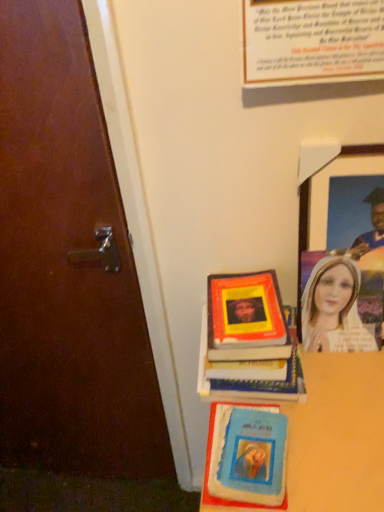
Question: From a real-world perspective, is blue matte book at lower center below smooth wooden table at lower right?

Choices:
 (A) no
 (B) yes

Answer: (A)

Question: From the image's perspective, is blue matte book at lower center on top of smooth wooden table at lower right?

Choices:
 (A) yes
 (B) no

Answer: (A)

Question: Is blue matte book at lower center closer to camera compared to smooth wooden table at lower right?

Choices:
 (A) yes
 (B) no

Answer: (B)

Question: Is blue matte book at lower center in contact with smooth wooden table at lower right?

Choices:
 (A) no
 (B) yes

Answer: (A)

Question: Does blue matte book at lower center have a lesser height compared to smooth wooden table at lower right?

Choices:
 (A) no
 (B) yes

Answer: (B)

Question: From the image's perspective, is blue matte book at lower center below smooth wooden table at lower right?

Choices:
 (A) no
 (B) yes

Answer: (A)

Question: From a real-world perspective, is wooden picture frame at upper right located higher than hardcover book at center?

Choices:
 (A) yes
 (B) no

Answer: (A)

Question: Is wooden picture frame at upper right facing away from hardcover book at center?

Choices:
 (A) yes
 (B) no

Answer: (B)

Question: Is wooden picture frame at upper right aimed at hardcover book at center?

Choices:
 (A) no
 (B) yes

Answer: (A)

Question: Can we say wooden picture frame at upper right lies outside hardcover book at center?

Choices:
 (A) yes
 (B) no

Answer: (A)

Question: Considering the relative sizes of wooden picture frame at upper right and hardcover book at center in the image provided, is wooden picture frame at upper right bigger than hardcover book at center?

Choices:
 (A) yes
 (B) no

Answer: (A)

Question: Is the position of wooden picture frame at upper right less distant than that of hardcover book at center?

Choices:
 (A) no
 (B) yes

Answer: (B)

Question: Can you confirm if smooth wooden table at lower right is smaller than blue matte book at lower center?

Choices:
 (A) yes
 (B) no

Answer: (B)